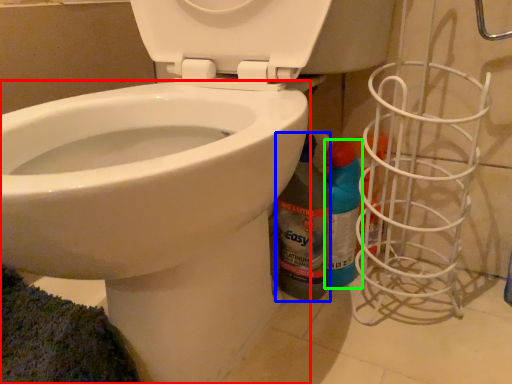
Question: Which object is the farthest from bidet (highlighted by a red box)? Choose among these: cleaning product (highlighted by a blue box) or cleaning product (highlighted by a green box).

Choices:
 (A) cleaning product
 (B) cleaning product

Answer: (B)